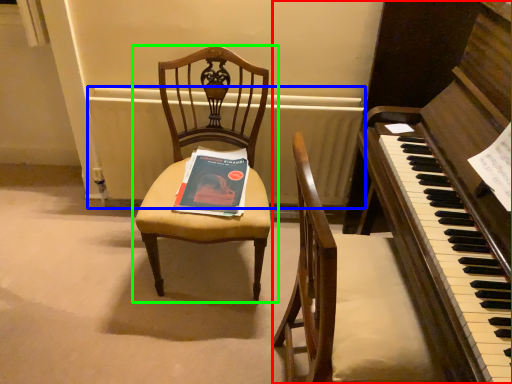
Question: Which is nearer to the harpsichord (highlighted by a red box)? radiator (highlighted by a blue box) or chair (highlighted by a green box).

Choices:
 (A) radiator
 (B) chair

Answer: (B)